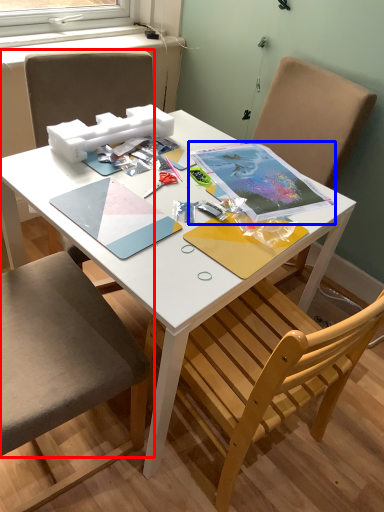
Question: Which point is further to the camera, chair (highlighted by a red box) or notebook (highlighted by a blue box)?

Choices:
 (A) chair
 (B) notebook

Answer: (B)